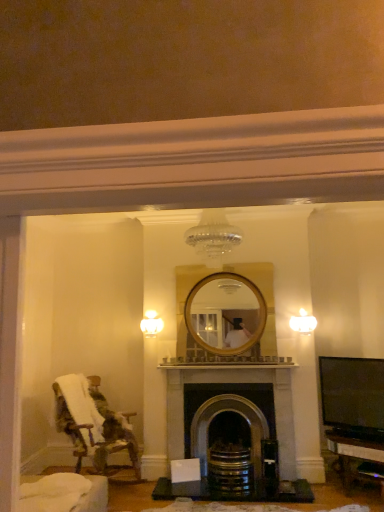
Question: Should I look upward or downward to see white frosted glass sconce at upper right, placed as the second light fixture when sorted from left to right?

Choices:
 (A) down
 (B) up

Answer: (A)

Question: Could fluffy fabric chair at left be considered to be inside white glass light fixture at upper center, the first light fixture in the back-to-front sequence?

Choices:
 (A) no
 (B) yes

Answer: (A)

Question: From a real-world perspective, is white glass light fixture at upper center, marked as the 1th light fixture in a left-to-right arrangement, over fluffy fabric chair at left?

Choices:
 (A) no
 (B) yes

Answer: (B)

Question: Considering the relative sizes of white glass light fixture at upper center, the second light fixture when ordered from front to back, and fluffy fabric chair at left in the image provided, is white glass light fixture at upper center, the second light fixture when ordered from front to back, bigger than fluffy fabric chair at left?

Choices:
 (A) yes
 (B) no

Answer: (B)

Question: From a real-world perspective, does white glass light fixture at upper center, the second light fixture when ordered from front to back, sit lower than fluffy fabric chair at left?

Choices:
 (A) yes
 (B) no

Answer: (B)

Question: Is white glass light fixture at upper center, the second light fixture when ordered from front to back, shorter than fluffy fabric chair at left?

Choices:
 (A) no
 (B) yes

Answer: (B)

Question: Is white glass light fixture at upper center, marked as the second light fixture in a right-to-left arrangement, wider than fluffy fabric chair at left?

Choices:
 (A) no
 (B) yes

Answer: (A)

Question: Is dark gray stone fireplace at center completely or partially inside white frosted glass sconce at upper right, the first light fixture positioned from the front?

Choices:
 (A) yes
 (B) no

Answer: (B)

Question: Can you confirm if white frosted glass sconce at upper right, which is counted as the first light fixture, starting from the right, is wider than dark gray stone fireplace at center?

Choices:
 (A) yes
 (B) no

Answer: (B)

Question: From a real-world perspective, is white frosted glass sconce at upper right, placed as the second light fixture when sorted from left to right, positioned over dark gray stone fireplace at center based on gravity?

Choices:
 (A) yes
 (B) no

Answer: (A)

Question: Considering the relative sizes of white frosted glass sconce at upper right, which is counted as the second light fixture, starting from the back, and dark gray stone fireplace at center in the image provided, is white frosted glass sconce at upper right, which is counted as the second light fixture, starting from the back, taller than dark gray stone fireplace at center?

Choices:
 (A) no
 (B) yes

Answer: (A)

Question: Considering the relative sizes of white frosted glass sconce at upper right, the first light fixture positioned from the front, and dark gray stone fireplace at center in the image provided, is white frosted glass sconce at upper right, the first light fixture positioned from the front, smaller than dark gray stone fireplace at center?

Choices:
 (A) yes
 (B) no

Answer: (A)

Question: Is white frosted glass sconce at upper right, placed as the second light fixture when sorted from left to right, positioned beyond the bounds of dark gray stone fireplace at center?

Choices:
 (A) yes
 (B) no

Answer: (A)

Question: Is dark gray stone fireplace at center outside white frosted glass sconce at upper right, which is counted as the second light fixture, starting from the back?

Choices:
 (A) no
 (B) yes

Answer: (B)